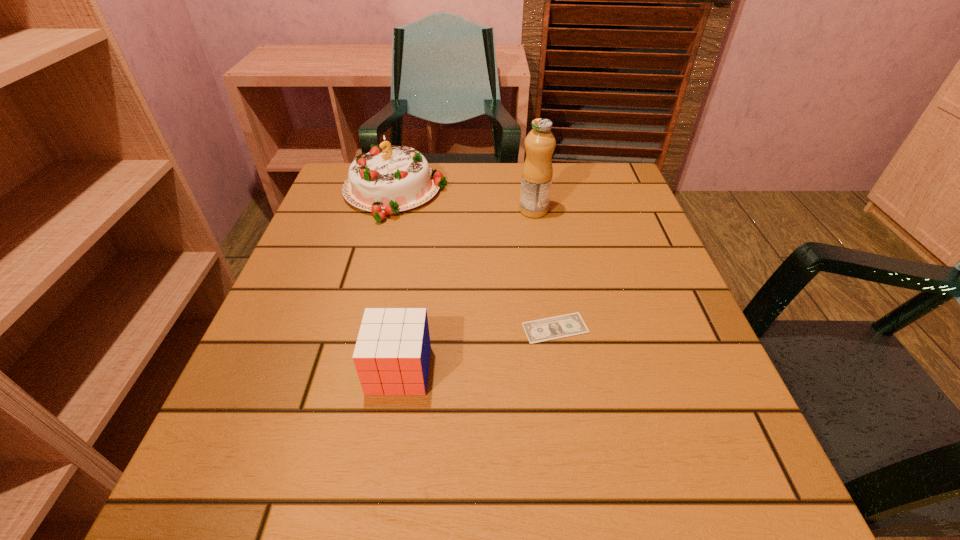
Locate an element on the screen. This screenshot has height=540, width=960. vacant region at the far right corner of the desktop is located at coordinates (611, 185).

The width and height of the screenshot is (960, 540). I want to click on free space between the shortest object and the cake, so coord(475,260).

I want to click on free space between the nearest object and the cake, so click(x=397, y=281).

Image resolution: width=960 pixels, height=540 pixels. What are the coordinates of `empty location between the cake and the money` in the screenshot? It's located at (475, 260).

Where is `empty space between the cube and the tallest object`? empty space between the cube and the tallest object is located at coordinates (467, 290).

Identify the location of vacant region between the shortest object and the tallest object. This screenshot has height=540, width=960. (544, 269).

Locate an element on the screen. The width and height of the screenshot is (960, 540). unoccupied area between the second shortest object and the tallest object is located at coordinates (467, 290).

The image size is (960, 540). I want to click on empty space between the second shortest object and the tallest object, so click(467, 290).

You are a GUI agent. You are given a task and a screenshot of the screen. Output one action in this format:
    pyautogui.click(x=<x>, y=<y>)
    Task: Click on the free space between the nearest object and the tallest object
    This screenshot has height=540, width=960.
    Given the screenshot: What is the action you would take?
    pyautogui.click(x=467, y=290)

I want to click on vacant region between the second tallest object and the tallest object, so click(x=465, y=201).